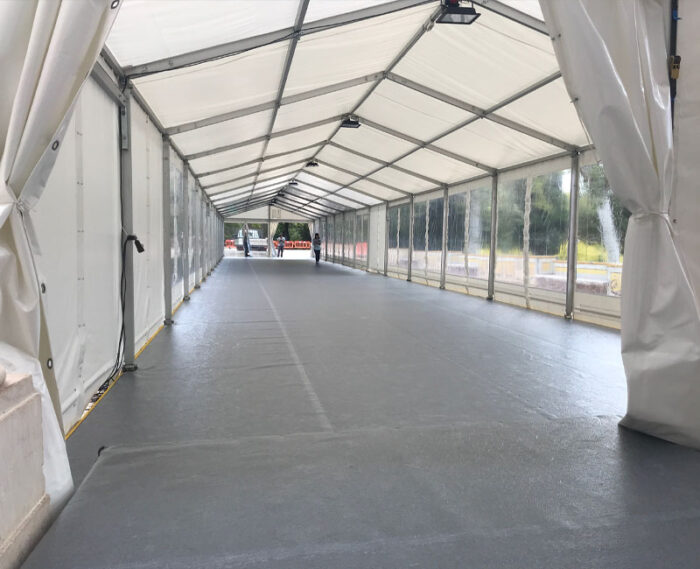
Where is `grey flooring`? The height and width of the screenshot is (569, 700). grey flooring is located at coordinates (322, 311).